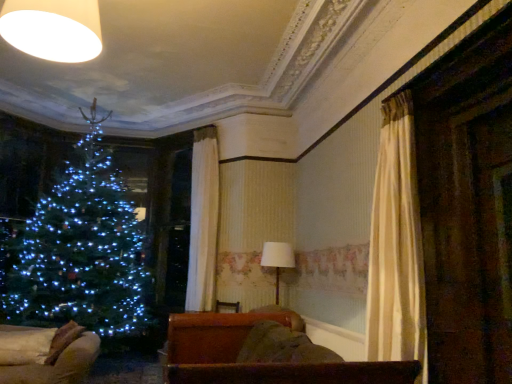
Identify the location of velvet beige sofa at lower left, which appears as the first furniture when viewed from the left. (59, 365).

Image resolution: width=512 pixels, height=384 pixels. I want to click on white fabric lampshade at center, so click(x=277, y=260).

This screenshot has width=512, height=384. I want to click on velvet beige sofa at lower left, which appears as the second furniture when viewed from the front, so click(x=59, y=365).

Considering the sizes of white fabric lampshade at center and brown leather couch at lower center, which ranks as the 1th furniture in right-to-left order, in the image, is white fabric lampshade at center bigger or smaller than brown leather couch at lower center, which ranks as the 1th furniture in right-to-left order,?

In the image, white fabric lampshade at center appears to be smaller than brown leather couch at lower center, which ranks as the 1th furniture in right-to-left order.

Is point (274, 260) in front of point (354, 374)?

No, (274, 260) is behind (354, 374).

Considering the relative sizes of white fabric lampshade at center and brown leather couch at lower center, which appears as the second furniture when viewed from the back, in the image provided, is white fabric lampshade at center shorter than brown leather couch at lower center, which appears as the second furniture when viewed from the back,?

In fact, white fabric lampshade at center may be taller than brown leather couch at lower center, which appears as the second furniture when viewed from the back.

Is white fabric lampshade at center in front of brown leather couch at lower center, which appears as the first furniture when viewed from the front?

No, white fabric lampshade at center is further to the viewer.

Based on the photo, could you measure the distance between white matte lampshade at upper left and brown leather couch at lower center, the second furniture viewed from the left?

They are 2.20 meters apart.

From the image's perspective, which one is positioned higher, white matte lampshade at upper left or brown leather couch at lower center, the second furniture viewed from the left?

white matte lampshade at upper left is shown above in the image.

Is white matte lampshade at upper left not near brown leather couch at lower center, which appears as the first furniture when viewed from the front?

Yes, white matte lampshade at upper left is far from brown leather couch at lower center, which appears as the first furniture when viewed from the front.

Would you say white matte lampshade at upper left is to the left or to the right of brown leather couch at lower center, the second furniture viewed from the left, in the picture?

In the image, white matte lampshade at upper left appears on the left side of brown leather couch at lower center, the second furniture viewed from the left.

Is point (222, 362) closer or farther from the camera than point (77, 42)?

Clearly, point (222, 362) is closer to the camera than point (77, 42).

From the picture: From the image's perspective, does brown leather couch at lower center, which ranks as the 1th furniture in right-to-left order, appear higher than white matte lampshade at upper left?

No, from the image's perspective, brown leather couch at lower center, which ranks as the 1th furniture in right-to-left order, is not above white matte lampshade at upper left.

Consider the image. Between brown leather couch at lower center, which appears as the first furniture when viewed from the front, and white matte lampshade at upper left, which one appears on the left side from the viewer's perspective?

Answer: Positioned to the left is white matte lampshade at upper left.

Between velvet beige sofa at lower left, which appears as the first furniture when viewed from the left, and white fabric lampshade at center, which one has larger width?

velvet beige sofa at lower left, which appears as the first furniture when viewed from the left, is wider.

From the image's perspective, is velvet beige sofa at lower left, which appears as the second furniture when viewed from the front, below white fabric lampshade at center?

Yes.

The image size is (512, 384). Identify the location of furniture located below the white fabric lampshade at center (from the image's perspective). (59, 365).

Is velvet beige sofa at lower left, the 2th furniture positioned from the right, surrounding white fabric lampshade at center?

No, white fabric lampshade at center is not inside velvet beige sofa at lower left, the 2th furniture positioned from the right.

From the picture: From a real-world perspective, which is physically below, white matte lampshade at upper left or velvet beige sofa at lower left, the 2th furniture positioned from the right?

From a 3D spatial view, velvet beige sofa at lower left, the 2th furniture positioned from the right, is below.

This screenshot has height=384, width=512. What are the coordinates of `furniture that appears behind the white matte lampshade at upper left` in the screenshot? It's located at (59, 365).

From the picture: Can you confirm if white matte lampshade at upper left is bigger than velvet beige sofa at lower left, the first furniture positioned from the back?

Incorrect, white matte lampshade at upper left is not larger than velvet beige sofa at lower left, the first furniture positioned from the back.

Can you confirm if white matte lampshade at upper left is wider than velvet beige sofa at lower left, which appears as the second furniture when viewed from the front?

No.

Between brown leather couch at lower center, the second furniture viewed from the left, and white fabric lampshade at center, which one has smaller size?

white fabric lampshade at center is smaller.

Is brown leather couch at lower center, which appears as the first furniture when viewed from the front, oriented away from white fabric lampshade at center?

No, brown leather couch at lower center, which appears as the first furniture when viewed from the front,'s orientation is not away from white fabric lampshade at center.

Find the location of a particular element. the 1st furniture counting from the left side of the white fabric lampshade at center is located at coordinates (258, 364).

How different are the orientations of brown leather couch at lower center, which appears as the second furniture when viewed from the back, and velvet beige sofa at lower left, the first furniture positioned from the back, in degrees?

The facing directions of brown leather couch at lower center, which appears as the second furniture when viewed from the back, and velvet beige sofa at lower left, the first furniture positioned from the back, are 89.7 degrees apart.

From a real-world perspective, is brown leather couch at lower center, which appears as the second furniture when viewed from the back, physically below velvet beige sofa at lower left, which appears as the first furniture when viewed from the left?

No, from a real-world perspective, brown leather couch at lower center, which appears as the second furniture when viewed from the back, is not beneath velvet beige sofa at lower left, which appears as the first furniture when viewed from the left.

Consider the image. Considering the relative sizes of brown leather couch at lower center, which appears as the second furniture when viewed from the back, and velvet beige sofa at lower left, which appears as the second furniture when viewed from the front, in the image provided, is brown leather couch at lower center, which appears as the second furniture when viewed from the back, thinner than velvet beige sofa at lower left, which appears as the second furniture when viewed from the front,?

Yes.

Would you say brown leather couch at lower center, which appears as the second furniture when viewed from the back, is outside velvet beige sofa at lower left, the 2th furniture positioned from the right?

Yes.

Starting from the white fabric lampshade at center, which furniture is the 2nd one in front? Please provide its 2D coordinates.

[(258, 364)]

Find the location of a particular element. The image size is (512, 384). lighting above the brown leather couch at lower center, which appears as the first furniture when viewed from the front (from a real-world perspective) is located at coordinates (53, 28).

Based on their spatial positions, is velvet beige sofa at lower left, which appears as the second furniture when viewed from the front, or white fabric lampshade at center further from white matte lampshade at upper left?

white fabric lampshade at center.

Considering their positions, is white matte lampshade at upper left positioned further to velvet beige sofa at lower left, which appears as the first furniture when viewed from the left, than white fabric lampshade at center?

The object further to velvet beige sofa at lower left, which appears as the first furniture when viewed from the left, is white fabric lampshade at center.

Estimate the real-world distances between objects in this image. Which object is closer to white matte lampshade at upper left, white fabric lampshade at center or brown leather couch at lower center, which appears as the second furniture when viewed from the back?

brown leather couch at lower center, which appears as the second furniture when viewed from the back, is positioned closer to the anchor white matte lampshade at upper left.

Estimate the real-world distances between objects in this image. Which object is further from brown leather couch at lower center, which appears as the first furniture when viewed from the front, white matte lampshade at upper left or velvet beige sofa at lower left, which appears as the first furniture when viewed from the left?

white matte lampshade at upper left is further to brown leather couch at lower center, which appears as the first furniture when viewed from the front.

Estimate the real-world distances between objects in this image. Which object is further from brown leather couch at lower center, which ranks as the 1th furniture in right-to-left order, white fabric lampshade at center or velvet beige sofa at lower left, the 2th furniture positioned from the right?

The object further to brown leather couch at lower center, which ranks as the 1th furniture in right-to-left order, is white fabric lampshade at center.

Considering their positions, is white matte lampshade at upper left positioned closer to white fabric lampshade at center than brown leather couch at lower center, which ranks as the 1th furniture in right-to-left order?

Among the two, brown leather couch at lower center, which ranks as the 1th furniture in right-to-left order, is located nearer to white fabric lampshade at center.

When comparing their distances from white matte lampshade at upper left, does brown leather couch at lower center, the second furniture viewed from the left, or white fabric lampshade at center seem further?

white fabric lampshade at center.

Which object lies nearer to the anchor point white fabric lampshade at center, velvet beige sofa at lower left, which appears as the second furniture when viewed from the front, or brown leather couch at lower center, which appears as the first furniture when viewed from the front?

velvet beige sofa at lower left, which appears as the second furniture when viewed from the front.

Find the location of a particular element. The image size is (512, 384). furniture between white matte lampshade at upper left and velvet beige sofa at lower left, which appears as the second furniture when viewed from the front, from top to bottom is located at coordinates (258, 364).

This screenshot has height=384, width=512. Identify the location of lighting between brown leather couch at lower center, the second furniture viewed from the left, and white fabric lampshade at center from front to back. (53, 28).

Where is `furniture located between white matte lampshade at upper left and white fabric lampshade at center in the depth direction`? The height and width of the screenshot is (384, 512). furniture located between white matte lampshade at upper left and white fabric lampshade at center in the depth direction is located at coordinates (59, 365).

Locate an element on the screen. The image size is (512, 384). furniture between brown leather couch at lower center, the second furniture viewed from the left, and white fabric lampshade at center from front to back is located at coordinates (59, 365).